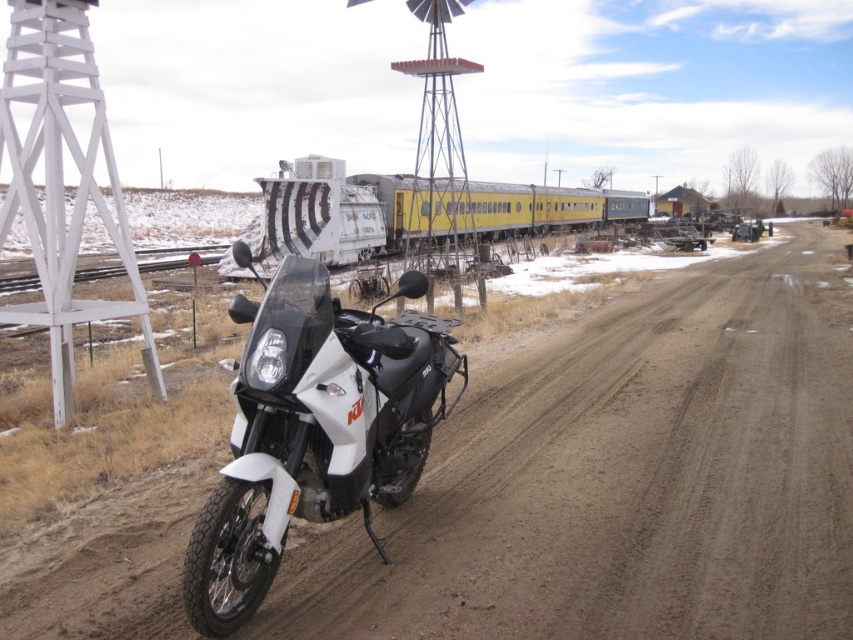
You are standing in front of the motorcycle and want to determine which of the two points, point (747, 317) or point (552, 189), is nearer to you. Based on the scene, which point is closer?

Point (747, 317) is closer to the camera than point (552, 189), so the point nearer to you is point (747, 317).

From the picture: You are a delivery driver with a motorcycle that is 2.5 meters long. You need to pass through the dirt track at center. Is your motorcycle too long to fit through the space available?

The space between the dirt track at center is 3.39 meters, so the motorcycle at 2.5 meters long can fit through the space available.